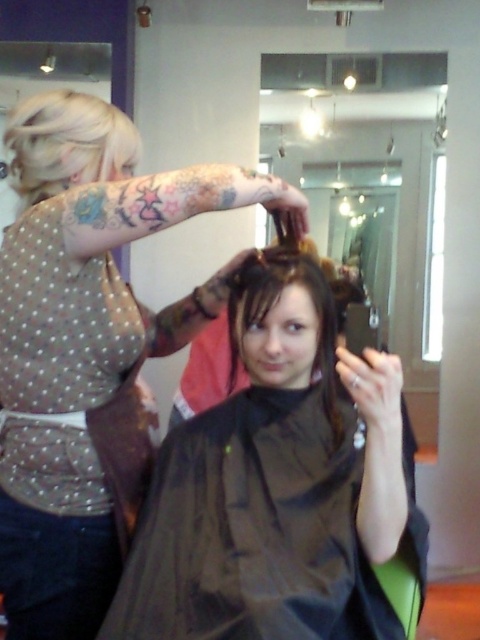
Question: Is shiny black hair at center to the left of dark brown hair at center from the viewer's perspective?

Choices:
 (A) no
 (B) yes

Answer: (A)

Question: Does matte black hair at center have a lesser width compared to dark brown hair at center?

Choices:
 (A) no
 (B) yes

Answer: (A)

Question: Is shiny black hair at center wider than dark brown hair at center?

Choices:
 (A) yes
 (B) no

Answer: (A)

Question: Which point is closer to the camera?

Choices:
 (A) (129, 582)
 (B) (40, 164)
 (C) (76, 266)
 (D) (251, 289)

Answer: (A)

Question: Among these points, which one is nearest to the camera?

Choices:
 (A) (241, 280)
 (B) (286, 528)
 (C) (48, 429)
 (D) (96, 176)

Answer: (B)

Question: Which point is closer to the camera?

Choices:
 (A) (88, 144)
 (B) (324, 403)

Answer: (A)